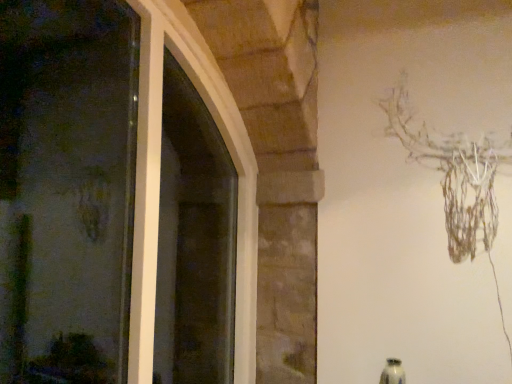
This screenshot has width=512, height=384. I want to click on brown textured tree branch at upper right, so click(x=454, y=175).

What do you see at coordinates (454, 175) in the screenshot? The width and height of the screenshot is (512, 384). I see `brown textured tree branch at upper right` at bounding box center [454, 175].

Where is `brown textured tree branch at upper right`? The height and width of the screenshot is (384, 512). brown textured tree branch at upper right is located at coordinates (454, 175).